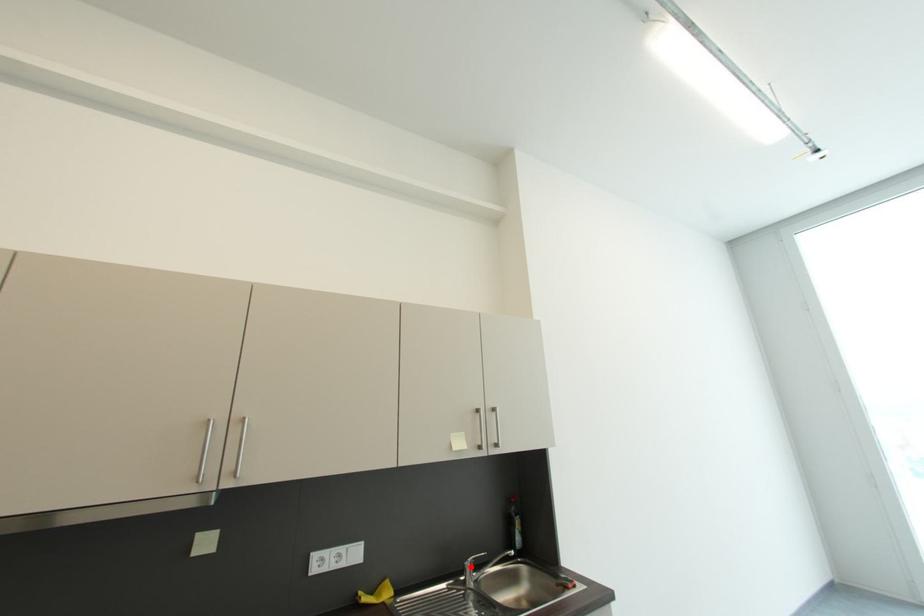
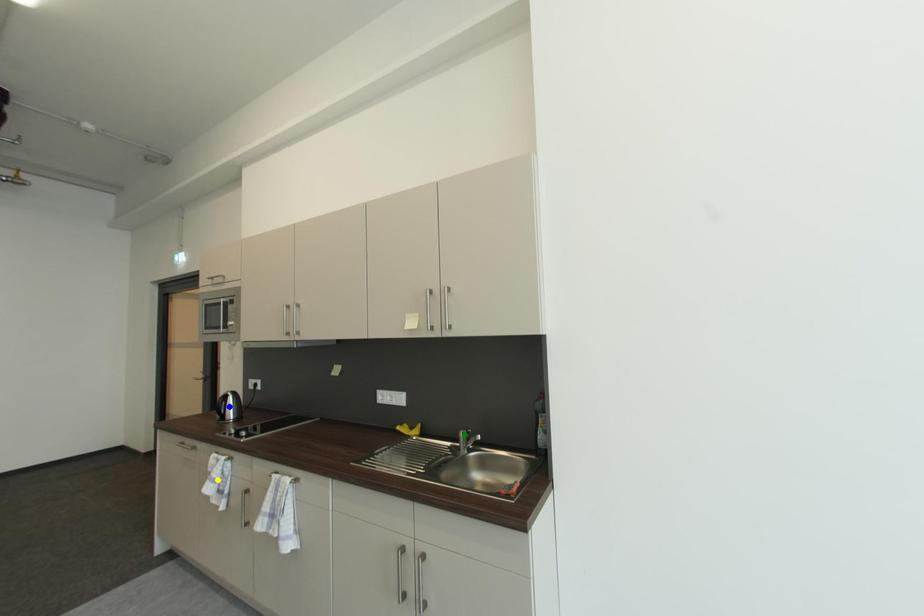
Question: I am providing you with two images of the same scene from different viewpoints. A red point is marked on the first image. You are given multiple points on the second image. Which point in image 2 is actually the same real-world point as the red point in image 1?

Choices:
 (A) yellow point
 (B) green point
 (C) blue point

Answer: (B)